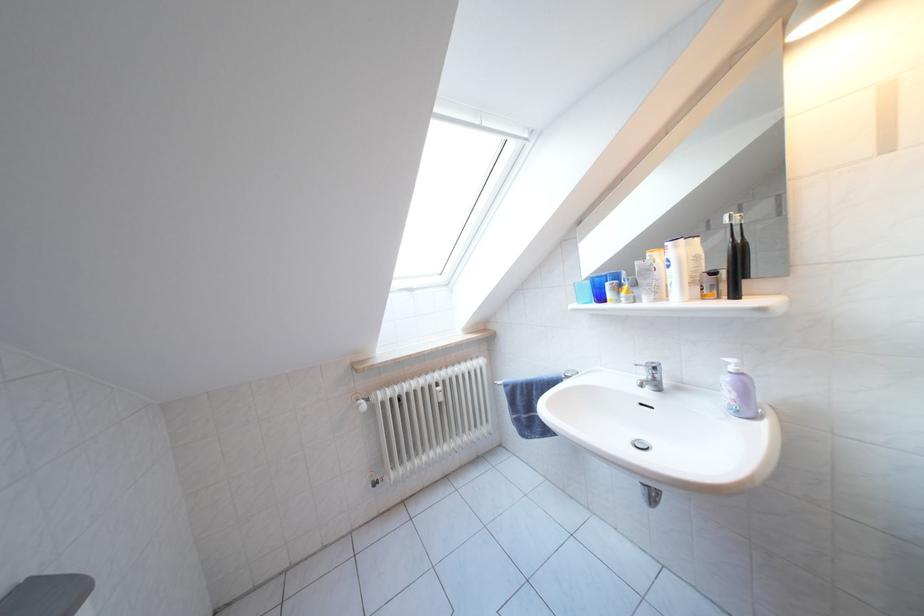
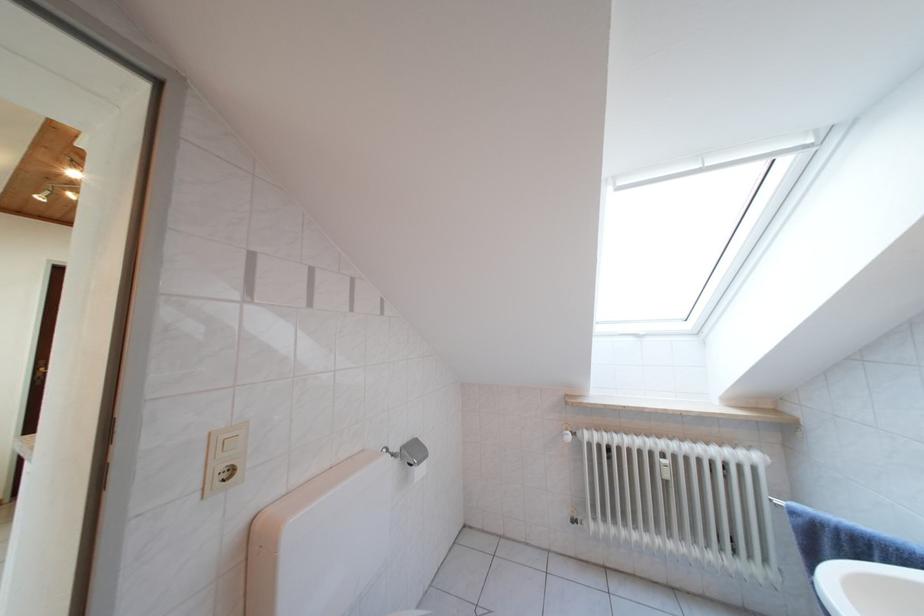
Locate, in the second image, the point that corresponds to point (381, 402) in the first image.

(588, 439)